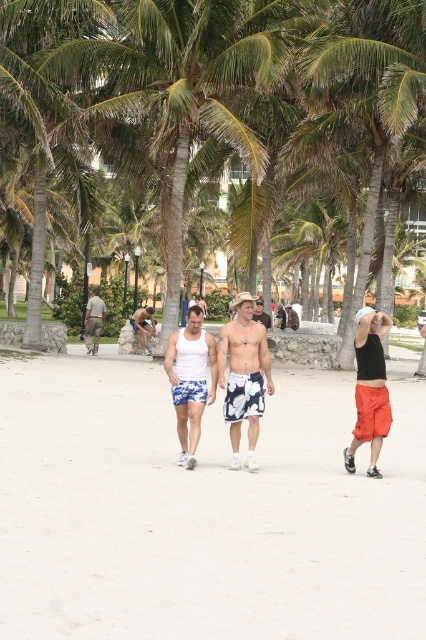
Question: Does white floral shorts at center have a greater width compared to black matte tank top at right?

Choices:
 (A) yes
 (B) no

Answer: (A)

Question: Does matte khaki shorts at left come in front of floral shorts at center?

Choices:
 (A) no
 (B) yes

Answer: (B)

Question: Is green leafy palm tree at center in front of white cotton tank top at center?

Choices:
 (A) no
 (B) yes

Answer: (A)

Question: Among these objects, which one is nearest to the camera?

Choices:
 (A) black matte tank top at right
 (B) white cotton tank top at center
 (C) floral shorts at center

Answer: (A)

Question: Estimate the real-world distances between objects in this image. Which object is farther from the white cotton tank top at center?

Choices:
 (A) floral shorts at center
 (B) white tank top at center
 (C) black matte tank top at right

Answer: (A)

Question: Which of the following is the farthest from the observer?

Choices:
 (A) green leafy palm tree at center
 (B) matte khaki shorts at left
 (C) white tank top at center
 (D) floral shorts at center

Answer: (D)